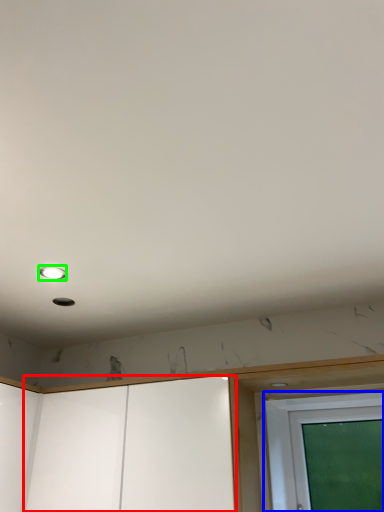
Question: Which object is the closest to the screen door (highlighted by a red box)? Choose among these: screen door (highlighted by a blue box) or droplight (highlighted by a green box).

Choices:
 (A) screen door
 (B) droplight

Answer: (A)